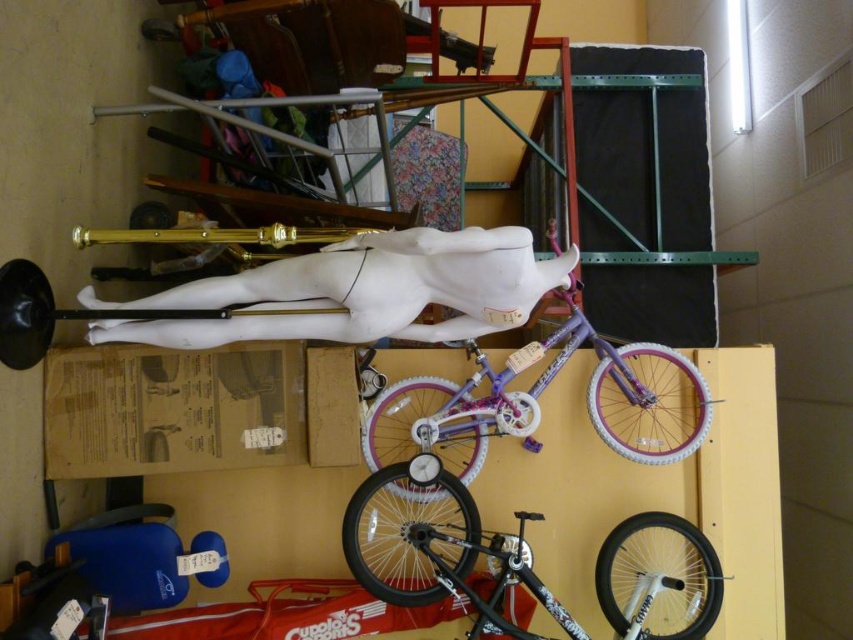
Is shiny black bicycle at center closer to the viewer compared to purple glossy bicycle at center?

Yes, shiny black bicycle at center is closer to the viewer.

Which is behind, point (654, 618) or point (633, 444)?

The point (633, 444) is more distant.

Is point (616, 550) farther from viewer compared to point (656, 413)?

No, it is not.

Identify the location of shiny black bicycle at center. The height and width of the screenshot is (640, 853). (437, 547).

Does white marble statue at center appear on the left side of shiny black bicycle at center?

Yes, white marble statue at center is to the left of shiny black bicycle at center.

Which is more to the right, white marble statue at center or shiny black bicycle at center?

From the viewer's perspective, shiny black bicycle at center appears more on the right side.

The width and height of the screenshot is (853, 640). Find the location of `white marble statue at center`. white marble statue at center is located at coordinates (357, 291).

Where is `white marble statue at center`? white marble statue at center is located at coordinates (357, 291).

What do you see at coordinates (357, 291) in the screenshot? This screenshot has height=640, width=853. I see `white marble statue at center` at bounding box center [357, 291].

Image resolution: width=853 pixels, height=640 pixels. What do you see at coordinates (357, 291) in the screenshot?
I see `white marble statue at center` at bounding box center [357, 291].

Where is `white marble statue at center`? Image resolution: width=853 pixels, height=640 pixels. white marble statue at center is located at coordinates (357, 291).